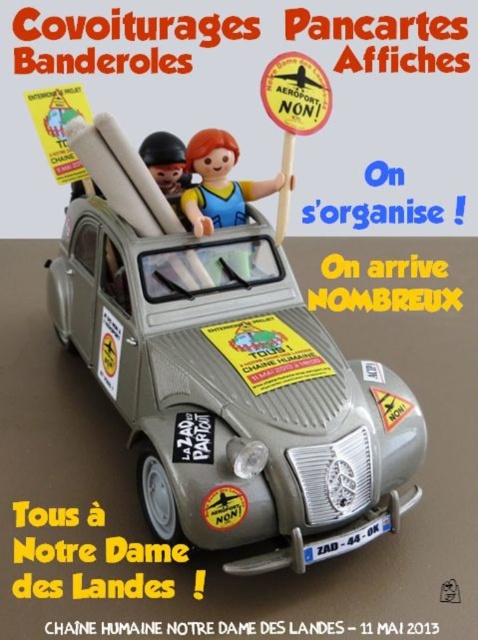
Question: Does matte gray car at center come in front of orange paper sign at upper center?

Choices:
 (A) yes
 (B) no

Answer: (A)

Question: Which of the following is the farthest from the observer?

Choices:
 (A) matte gray car at center
 (B) orange paper sign at upper center

Answer: (B)

Question: Among these points, which one is nearest to the camera?

Choices:
 (A) (265, 106)
 (B) (219, 170)

Answer: (A)

Question: Is matte gray car at center thinner than orange paper sign at upper center?

Choices:
 (A) no
 (B) yes

Answer: (A)

Question: Among these points, which one is farthest from the camera?

Choices:
 (A) (218, 150)
 (B) (292, 65)
 (C) (182, 422)

Answer: (A)

Question: Where is plastic toy figure at center located in relation to orange paper sign at upper center in the image?

Choices:
 (A) below
 (B) above

Answer: (A)